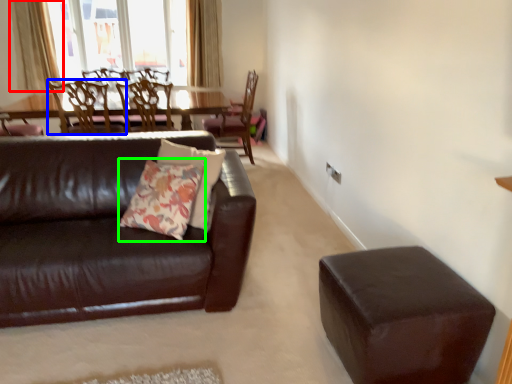
Question: Which object is the closest to the curtain (highlighted by a red box)? Choose among these: chair (highlighted by a blue box) or throw pillow (highlighted by a green box).

Choices:
 (A) chair
 (B) throw pillow

Answer: (A)